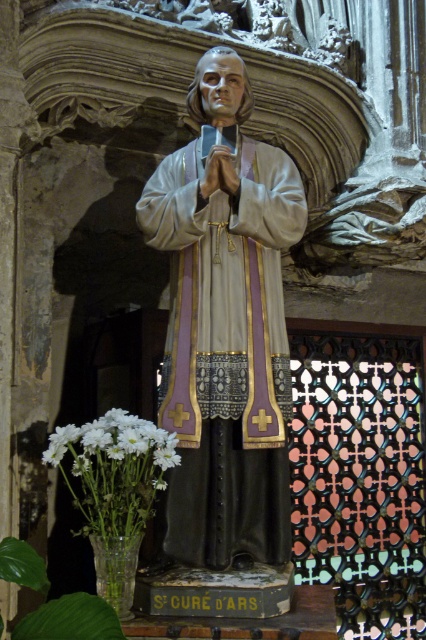
You are standing in front of the statue of Saint John Vianney in the church. You notice two points marked on the statue base. The first point is at coordinates point (195, 160) and the second is at point (170, 456). If you were to touch both points with your finger, which point would require you to reach further away from your body?

Point (170, 456) is closer to the camera than point (195, 160), so touching point (170, 456) would require reaching less. Conversely, point (195, 160) is further away from you, so reaching it would require extending your arm further away from your body.

You are standing in the church and want to take a photo of the statue of Saint John Vianney. The statue is located at point (226, 348). If you are standing at point 0.4, 0.6, which direction should you move to get a better view of the statue?

You should move towards the statue located at point (226, 348) from your current position at 0.4, 0.6 to get a better view.

You are standing in a church and want to place a small candle on the nearest object to you between the matte wood statue at center and the white matte flowers at lower left. Which object should you choose?

The matte wood statue at center is closer to you than the white matte flowers at lower left, so you should place the candle on the matte wood statue at center.